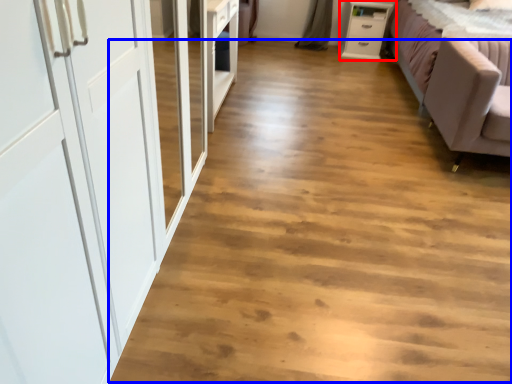
Question: Among these objects, which one is farthest to the camera, chest of drawers (highlighted by a red box) or plain (highlighted by a blue box)?

Choices:
 (A) chest of drawers
 (B) plain

Answer: (A)